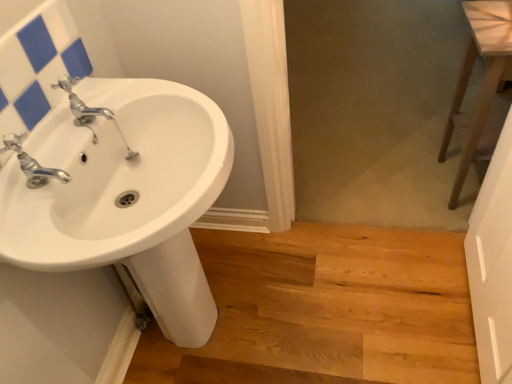
Question: Should I look upward or downward to see white glossy sink at upper left?

Choices:
 (A) down
 (B) up

Answer: (B)

Question: Can you confirm if white glossy sink at upper left is thinner than chrome metallic faucet at upper left?

Choices:
 (A) yes
 (B) no

Answer: (A)

Question: From a real-world perspective, is white glossy sink at upper left physically above chrome metallic faucet at upper left?

Choices:
 (A) no
 (B) yes

Answer: (B)

Question: Does white glossy sink at upper left have a smaller size compared to chrome metallic faucet at upper left?

Choices:
 (A) yes
 (B) no

Answer: (B)

Question: Can you confirm if white glossy sink at upper left is bigger than chrome metallic faucet at upper left?

Choices:
 (A) no
 (B) yes

Answer: (B)

Question: Are white glossy sink at upper left and chrome metallic faucet at upper left beside each other?

Choices:
 (A) no
 (B) yes

Answer: (B)

Question: Considering the relative sizes of white glossy sink at upper left and chrome metallic faucet at upper left in the image provided, is white glossy sink at upper left shorter than chrome metallic faucet at upper left?

Choices:
 (A) yes
 (B) no

Answer: (B)

Question: Is the surface of brown wooden stool at right in direct contact with silver metallic faucet at left?

Choices:
 (A) no
 (B) yes

Answer: (A)

Question: Considering the relative sizes of brown wooden stool at right and silver metallic faucet at left in the image provided, is brown wooden stool at right wider than silver metallic faucet at left?

Choices:
 (A) no
 (B) yes

Answer: (B)

Question: Can you confirm if brown wooden stool at right is shorter than silver metallic faucet at left?

Choices:
 (A) no
 (B) yes

Answer: (A)

Question: Does brown wooden stool at right come in front of silver metallic faucet at left?

Choices:
 (A) no
 (B) yes

Answer: (A)

Question: Is brown wooden stool at right at the right side of silver metallic faucet at left?

Choices:
 (A) no
 (B) yes

Answer: (B)

Question: Is brown wooden stool at right not inside silver metallic faucet at left?

Choices:
 (A) yes
 (B) no

Answer: (A)

Question: Can you confirm if white glossy sink at left is bigger than brown wooden stool at right?

Choices:
 (A) no
 (B) yes

Answer: (B)